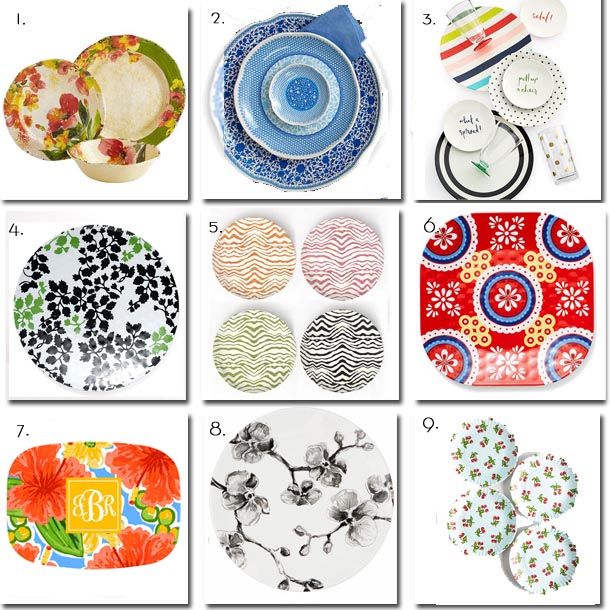
Find the location of a particular element. The width and height of the screenshot is (610, 610). four plates with cherries on top is located at coordinates (540, 564), (544, 472), (492, 449), (475, 537).